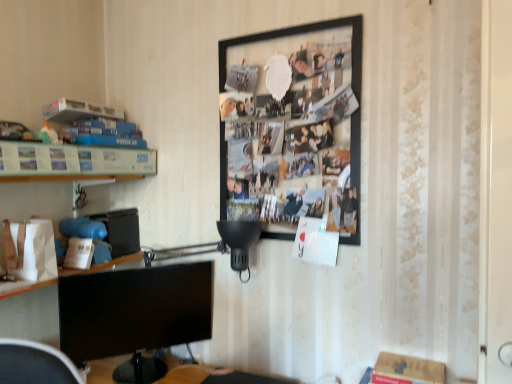
Question: Could you tell me if black glossy monitor at lower left is turned towards black matte picture frame at upper center?

Choices:
 (A) yes
 (B) no

Answer: (B)

Question: Does black glossy monitor at lower left come in front of black matte picture frame at upper center?

Choices:
 (A) yes
 (B) no

Answer: (B)

Question: Is black glossy monitor at lower left to the left of black matte picture frame at upper center from the viewer's perspective?

Choices:
 (A) yes
 (B) no

Answer: (A)

Question: Does black glossy monitor at lower left have a greater width compared to black matte picture frame at upper center?

Choices:
 (A) yes
 (B) no

Answer: (A)

Question: Can you confirm if black glossy monitor at lower left is positioned to the right of black matte picture frame at upper center?

Choices:
 (A) no
 (B) yes

Answer: (A)

Question: From the image's perspective, is black glossy monitor at lower left located beneath black matte picture frame at upper center?

Choices:
 (A) no
 (B) yes

Answer: (B)

Question: Considering the relative positions of metallic silver frame at left and black glossy monitor at lower left in the image provided, is metallic silver frame at left to the left of black glossy monitor at lower left from the viewer's perspective?

Choices:
 (A) yes
 (B) no

Answer: (A)

Question: Is metallic silver frame at left aimed at black glossy monitor at lower left?

Choices:
 (A) yes
 (B) no

Answer: (B)

Question: From the image's perspective, is metallic silver frame at left located beneath black glossy monitor at lower left?

Choices:
 (A) yes
 (B) no

Answer: (B)

Question: Is metallic silver frame at left completely or partially outside of black glossy monitor at lower left?

Choices:
 (A) no
 (B) yes

Answer: (B)

Question: Can you confirm if metallic silver frame at left is wider than black glossy monitor at lower left?

Choices:
 (A) yes
 (B) no

Answer: (A)

Question: Does metallic silver frame at left have a larger size compared to black glossy monitor at lower left?

Choices:
 (A) no
 (B) yes

Answer: (A)

Question: Could you tell me if black matte picture frame at upper center is facing metallic silver frame at left?

Choices:
 (A) yes
 (B) no

Answer: (B)